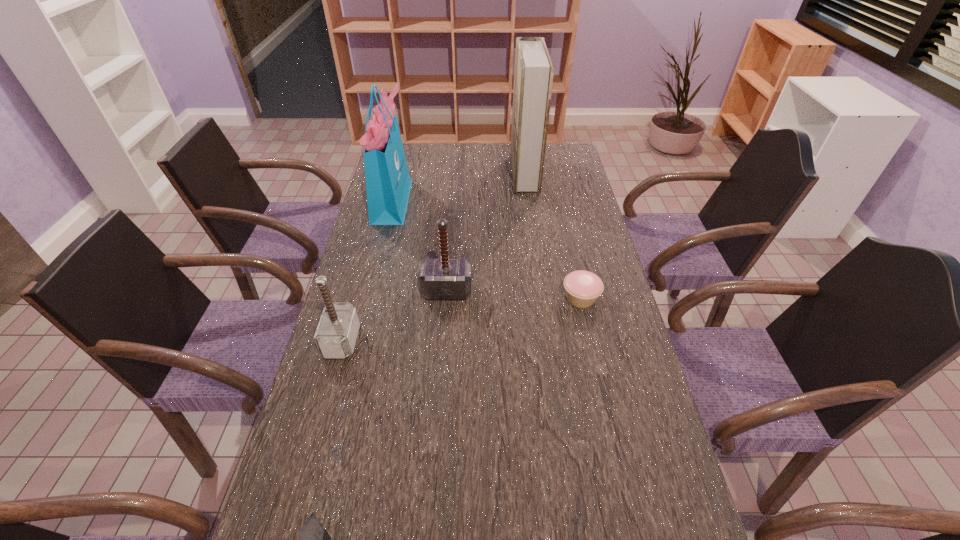
Where is `phonebook`? This screenshot has width=960, height=540. phonebook is located at coordinates (533, 74).

You are a GUI agent. You are given a task and a screenshot of the screen. Output one action in this format:
    pyautogui.click(x=<x>, y=<y>)
    Task: Click on the shopping bag
    The image size is (960, 540).
    Given the screenshot: What is the action you would take?
    pyautogui.click(x=388, y=183)

The height and width of the screenshot is (540, 960). I want to click on the farthest hammer, so click(x=444, y=278).

This screenshot has height=540, width=960. In order to click on the fifth farthest object in this screenshot , I will do `click(336, 334)`.

Where is `cupcake`? The width and height of the screenshot is (960, 540). cupcake is located at coordinates (583, 288).

Find the location of `the rightmost object`. the rightmost object is located at coordinates (583, 288).

Where is `free space located 0.140m on the cover of the phonebook`? The width and height of the screenshot is (960, 540). free space located 0.140m on the cover of the phonebook is located at coordinates (476, 174).

You are a GUI agent. You are given a task and a screenshot of the screen. Output one action in this format:
    pyautogui.click(x=<x>, y=<y>)
    Task: Click on the vacant space located 0.330m on the cover of the phonebook
    
    Given the screenshot: What is the action you would take?
    pyautogui.click(x=428, y=174)

Find the location of `vacant space situated 0.170m on the cover of the phonebook`. vacant space situated 0.170m on the cover of the phonebook is located at coordinates (468, 174).

Where is `blank space located 0.370m on the right of the shopping bag`? This screenshot has width=960, height=540. blank space located 0.370m on the right of the shopping bag is located at coordinates (x=510, y=200).